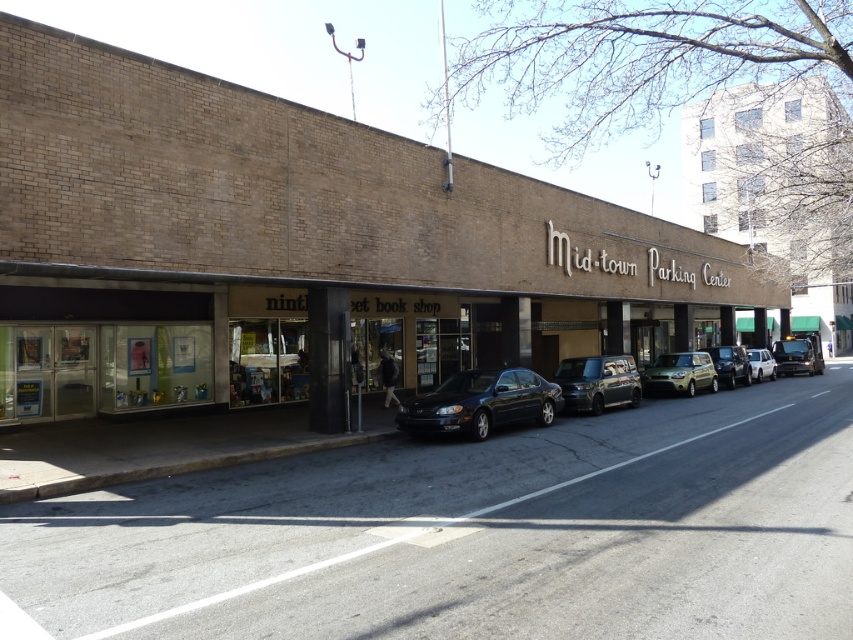
Is matte black sedan at center above metallic silver car at center?

No, matte black sedan at center is not above metallic silver car at center.

Does point (544, 410) come in front of point (714, 384)?

Yes, it is in front of point (714, 384).

In order to click on matte black sedan at center in this screenshot , I will do `click(480, 403)`.

Is shiny black sedan at center further to the viewer compared to white matte van at right?

No.

Image resolution: width=853 pixels, height=640 pixels. Describe the element at coordinates (517, 396) in the screenshot. I see `shiny black sedan at center` at that location.

Between point (621, 401) and point (759, 365), which one is positioned behind?

The point (759, 365) is more distant.

Identify the location of shiny black sedan at center. (517, 396).

Is black asphalt road at center closer to the viewer compared to metallic silver car at center?

Yes, it is in front of metallic silver car at center.

Is point (187, 618) positioned after point (666, 362)?

That is False.

Does point (721, 520) lie behind point (688, 387)?

No.

At what (x,y) coordinates should I click in order to perform the action: click on black asphalt road at center. Please return your answer as a coordinate pair (x, y). The height and width of the screenshot is (640, 853). Looking at the image, I should click on (509, 532).